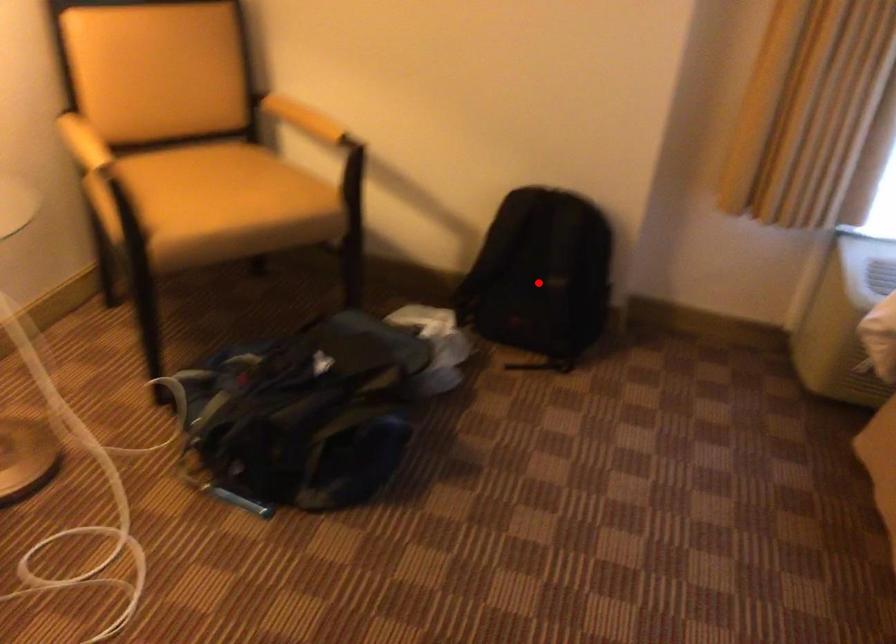
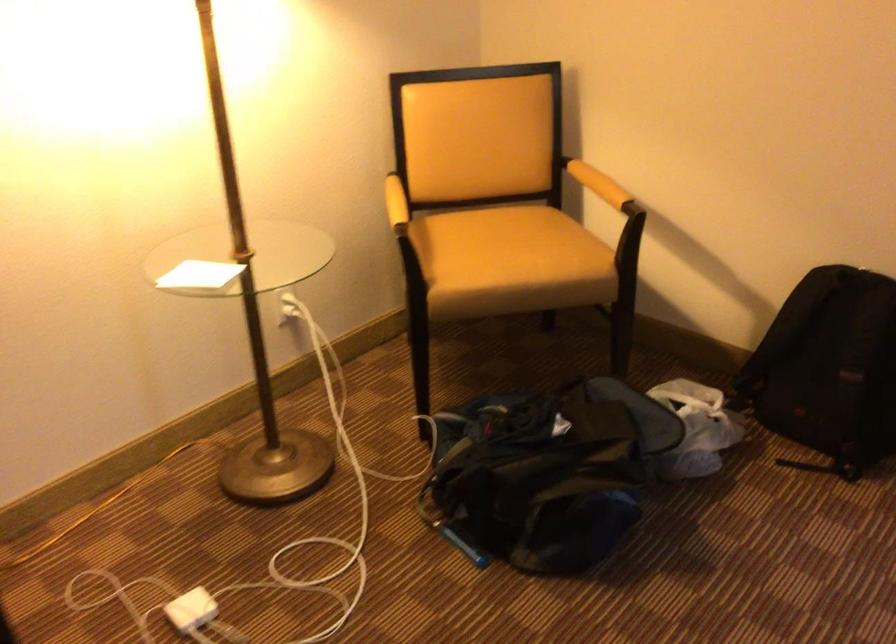
Question: I am providing you with two images of the same scene from different viewpoints. In image1, a red point is highlighted. Considering the same 3D point in image2, which of the following is correct?

Choices:
 (A) It is closer
 (B) It is farther

Answer: (A)